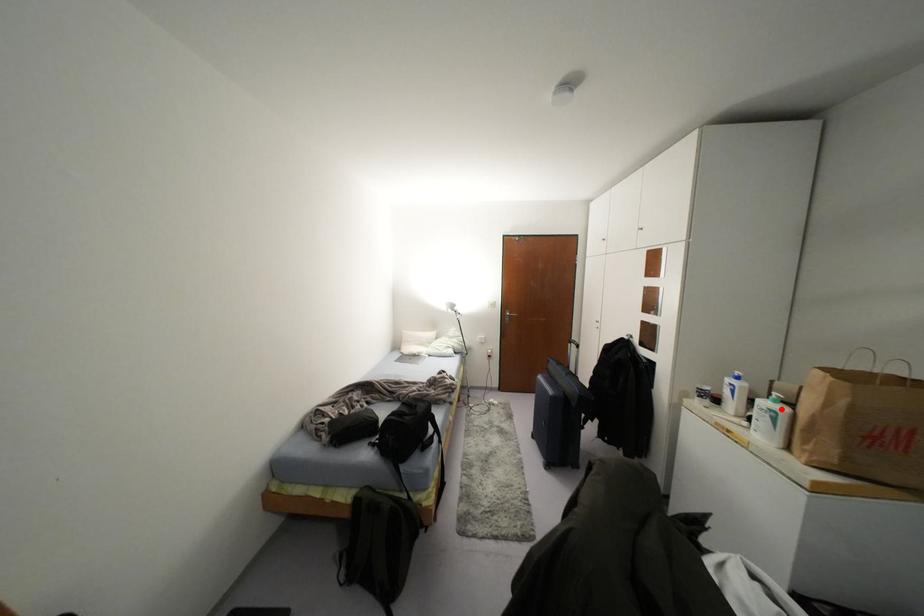
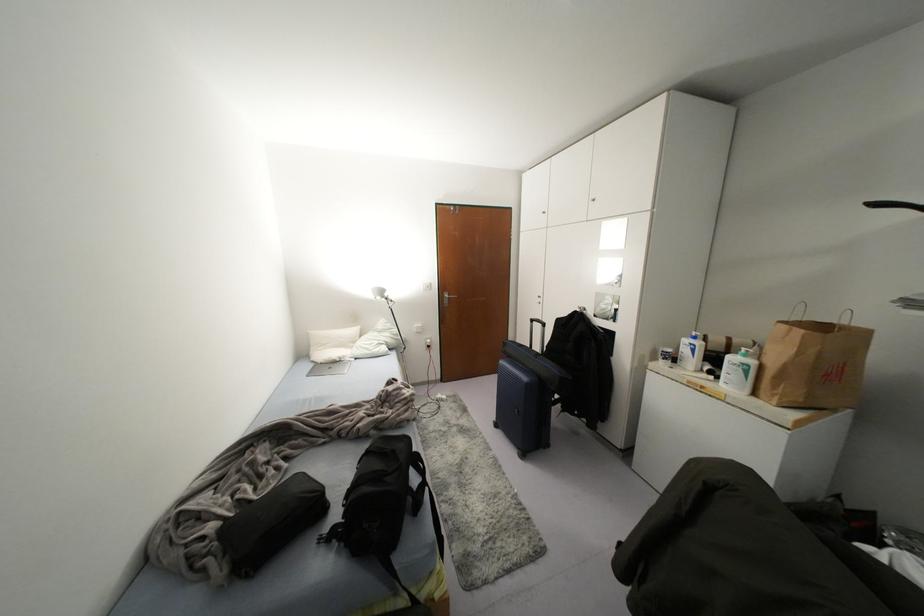
In the second image, find the point that corresponds to the highlighted location in the first image.

(751, 362)